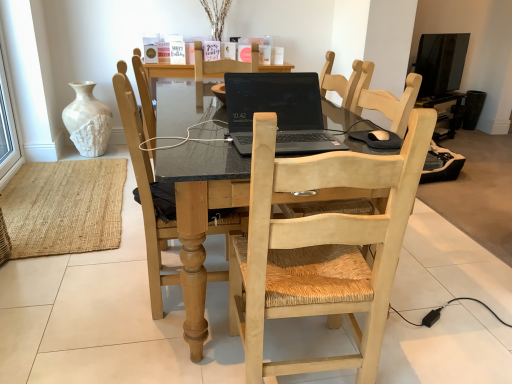
Question: Can you confirm if light wood woven seat at center, the 2th chair in the left-to-right sequence, is positioned to the left of black glossy tv at upper right?

Choices:
 (A) no
 (B) yes

Answer: (B)

Question: Is black glossy tv at upper right surrounded by light wood woven seat at center, the 2th chair in the left-to-right sequence?

Choices:
 (A) yes
 (B) no

Answer: (B)

Question: Is light wood woven seat at center, arranged as the first chair when viewed from the right, closer to the viewer compared to black glossy tv at upper right?

Choices:
 (A) yes
 (B) no

Answer: (A)

Question: From a real-world perspective, is light wood woven seat at center, the 2th chair in the left-to-right sequence, physically above black glossy tv at upper right?

Choices:
 (A) yes
 (B) no

Answer: (B)

Question: Is light wood woven seat at center, arranged as the first chair when viewed from the right, outside of black glossy tv at upper right?

Choices:
 (A) no
 (B) yes

Answer: (B)

Question: Is the depth of light wood woven seat at center, arranged as the first chair when viewed from the right, greater than that of black glossy tv at upper right?

Choices:
 (A) yes
 (B) no

Answer: (B)

Question: Does transparent glass window at left have a lesser width compared to light wood chair at center, which is the 1th chair in left-to-right order?

Choices:
 (A) no
 (B) yes

Answer: (B)

Question: Is transparent glass window at left shorter than light wood chair at center, the second chair when ordered from right to left?

Choices:
 (A) no
 (B) yes

Answer: (A)

Question: From the image's perspective, would you say transparent glass window at left is positioned over light wood chair at center, which is the 1th chair in left-to-right order?

Choices:
 (A) yes
 (B) no

Answer: (A)

Question: Does transparent glass window at left contain light wood chair at center, the second chair when ordered from right to left?

Choices:
 (A) yes
 (B) no

Answer: (B)

Question: Could you tell me if transparent glass window at left is facing light wood chair at center, the second chair when ordered from right to left?

Choices:
 (A) no
 (B) yes

Answer: (A)

Question: From the image's perspective, is transparent glass window at left below light wood chair at center, which is the 1th chair in left-to-right order?

Choices:
 (A) yes
 (B) no

Answer: (B)

Question: Are black matte laptop at center and light wood woven seat at center, arranged as the first chair when viewed from the right, beside each other?

Choices:
 (A) yes
 (B) no

Answer: (B)